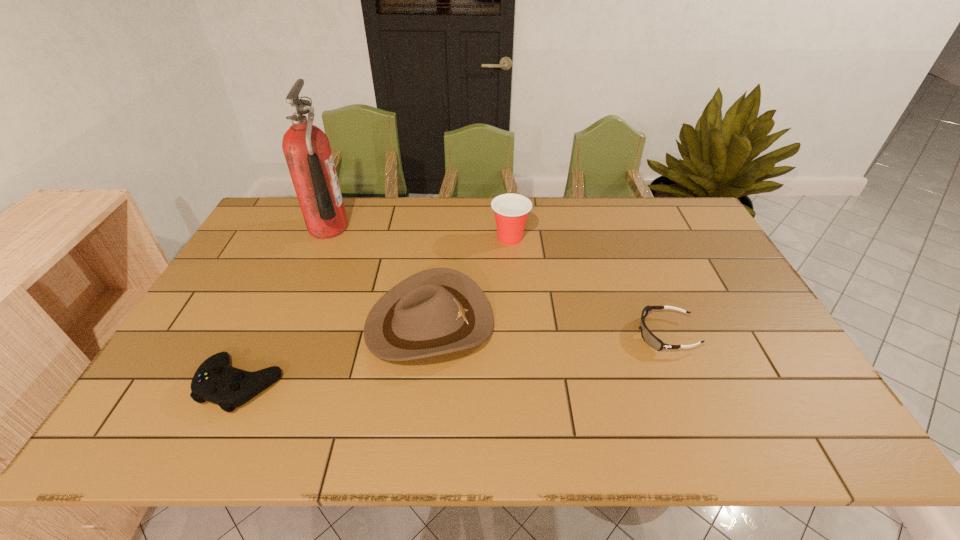
In the image, there is a desktop. Where is `vacant space at the left edge`? The height and width of the screenshot is (540, 960). vacant space at the left edge is located at coordinates (211, 322).

Identify the location of free space at the far left corner of the desktop. The width and height of the screenshot is (960, 540). (280, 198).

The width and height of the screenshot is (960, 540). I want to click on blank area at the far right corner, so click(670, 205).

In the image, there is a desktop. At what (x,y) coordinates should I click in order to perform the action: click on vacant space at the near right corner. Please return your answer as a coordinate pair (x, y). The width and height of the screenshot is (960, 540). Looking at the image, I should click on (762, 418).

Where is `free spot between the cowboy hat and the fourth tallest object`? The image size is (960, 540). free spot between the cowboy hat and the fourth tallest object is located at coordinates (335, 354).

I want to click on unoccupied area between the goggles and the cowboy hat, so click(547, 329).

At what (x,y) coordinates should I click in order to perform the action: click on vacant space that is in between the second shortest object and the tallest object. Please return your answer as a coordinate pair (x, y). The height and width of the screenshot is (540, 960). Looking at the image, I should click on (284, 306).

Identify the location of vacant space in between the tallest object and the cowboy hat. (379, 276).

Where is `free space between the cowboy hat and the rightmost object`? This screenshot has width=960, height=540. free space between the cowboy hat and the rightmost object is located at coordinates (547, 329).

Image resolution: width=960 pixels, height=540 pixels. Find the location of `free point between the cowboy hat and the tallest object`. free point between the cowboy hat and the tallest object is located at coordinates (379, 276).